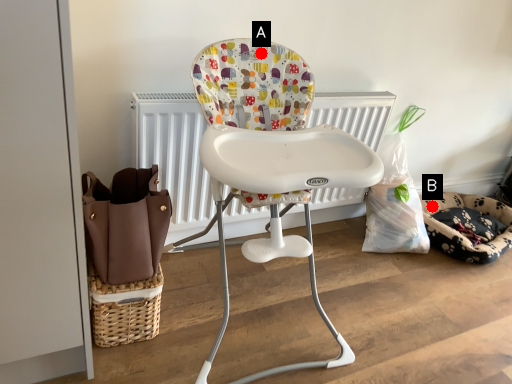
Question: Two points are circled on the image, labeled by A and B beside each circle. Which point is farther to the camera?

Choices:
 (A) A is further
 (B) B is further

Answer: (B)